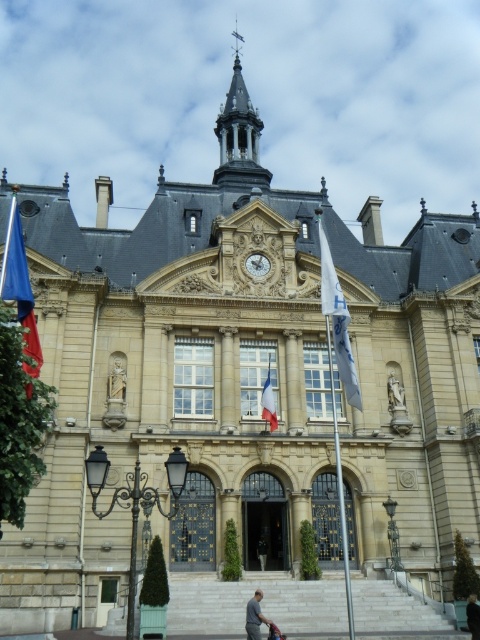
Is point (11, 212) farther from camera compared to point (278, 636)?

Yes, it is behind point (278, 636).

Between point (39, 353) and point (276, 628), which one is positioned in front?

Point (276, 628) is in front.

This screenshot has width=480, height=640. In order to click on blue fabric flag at left in this screenshot , I will do `click(20, 288)`.

Is french flag at center in front of dark gray fabric at center?

No.

Does french flag at center appear under dark gray fabric at center?

Actually, french flag at center is above dark gray fabric at center.

Between point (267, 376) and point (265, 548), which one is positioned behind?

Positioned behind is point (267, 376).

I want to click on french flag at center, so click(x=268, y=403).

Is point (276, 424) behind point (396, 404)?

No.

Does french flag at center appear over white marble statue at center?

Actually, french flag at center is below white marble statue at center.

This screenshot has width=480, height=640. I want to click on french flag at center, so (268, 403).

Identify the location of french flag at center. (268, 403).